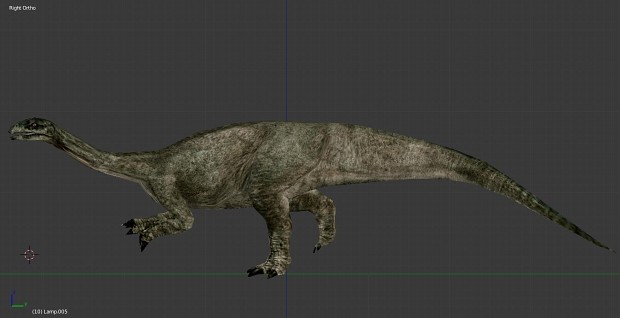
Find the location of a particular element. left front leg is located at coordinates (157, 230).